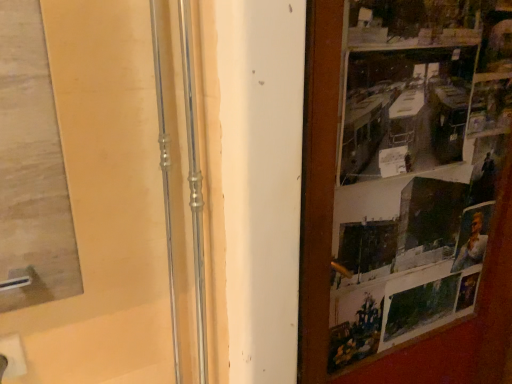
Find the location of a particular element. The width and height of the screenshot is (512, 384). polished chrome shower door at center is located at coordinates (194, 190).

What do you see at coordinates (194, 190) in the screenshot? I see `polished chrome shower door at center` at bounding box center [194, 190].

Identify the location of polished chrome shower door at center. The height and width of the screenshot is (384, 512). (194, 190).